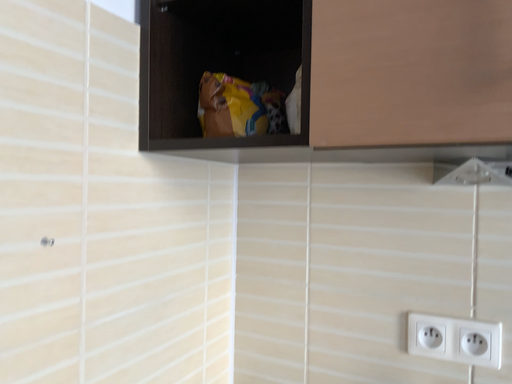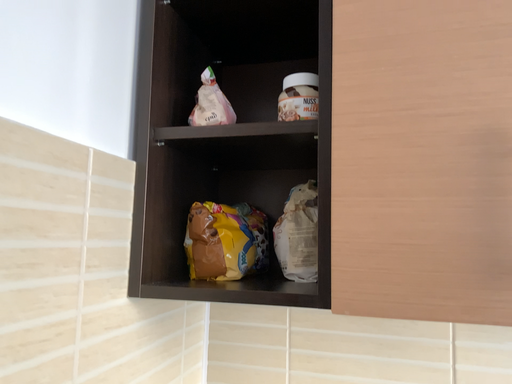
Question: Which way did the camera rotate in the video?

Choices:
 (A) rotated downward
 (B) rotated upward

Answer: (B)